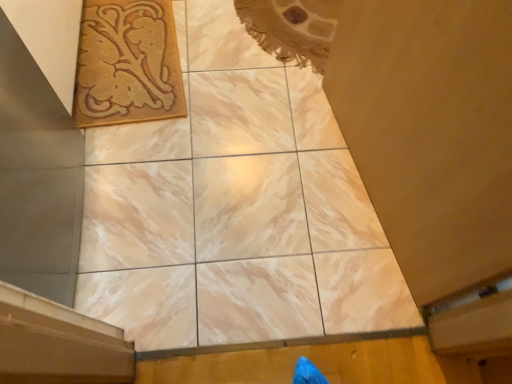
Question: In the image, is wooden at lower right on the left side or the right side of beige woven rug at upper left?

Choices:
 (A) right
 (B) left

Answer: (A)

Question: Considering the positions of point (187, 355) and point (159, 11), is point (187, 355) closer or farther from the camera than point (159, 11)?

Choices:
 (A) closer
 (B) farther

Answer: (A)

Question: Based on their relative distances, which object is farther from the beige woven rug at upper left?

Choices:
 (A) marble tile at center
 (B) wooden at lower right

Answer: (B)

Question: Based on their relative distances, which object is nearer to the beige woven rug at upper left?

Choices:
 (A) wooden at lower right
 (B) marble tile at center

Answer: (B)